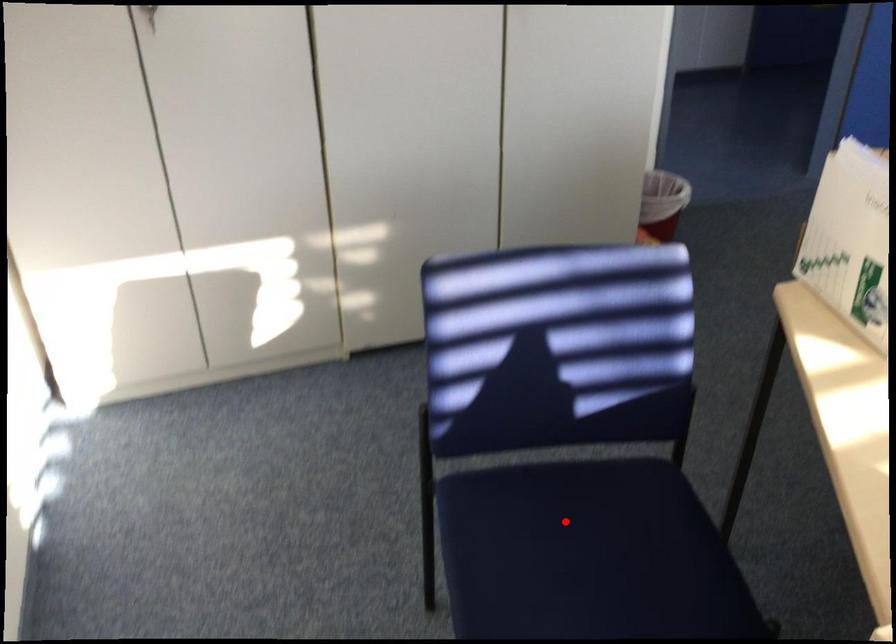
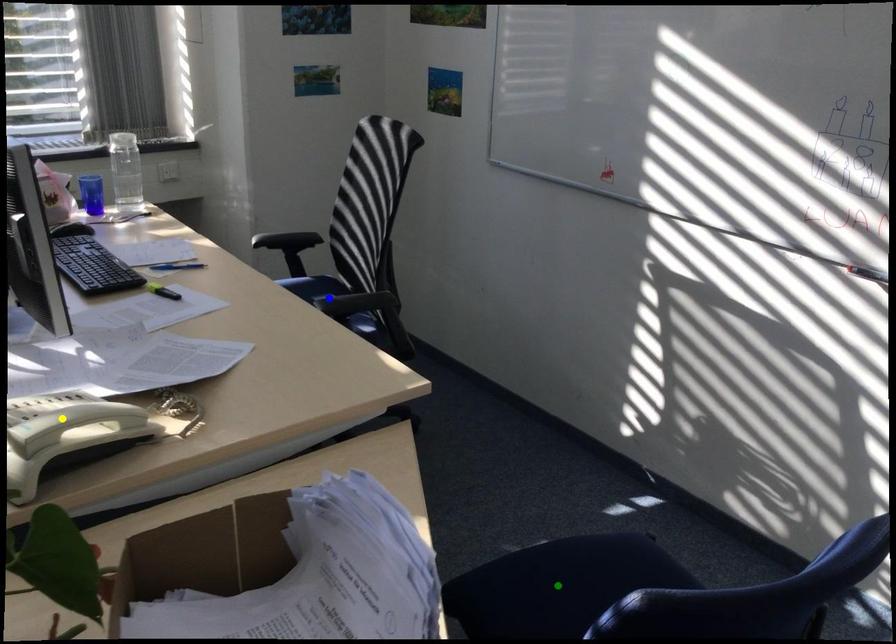
Question: I am providing you with two images of the same scene from different viewpoints. A red point is marked on the first image. You are given multiple points on the second image. Can you choose the point in image 2 that corresponds to the point in image 1?

Choices:
 (A) yellow point
 (B) blue point
 (C) green point

Answer: (C)